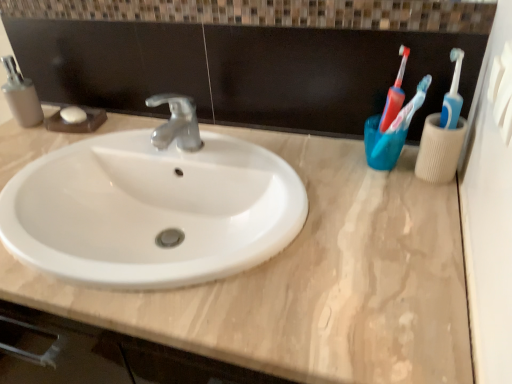
What are the coordinates of `vacant area that is in front of translucent blue toothbrush at upper right` in the screenshot? It's located at (399, 218).